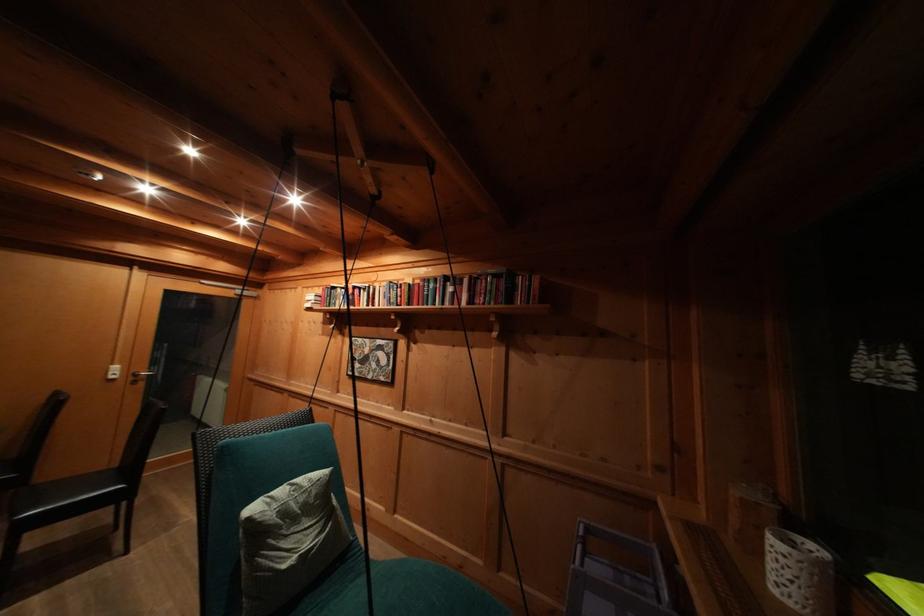
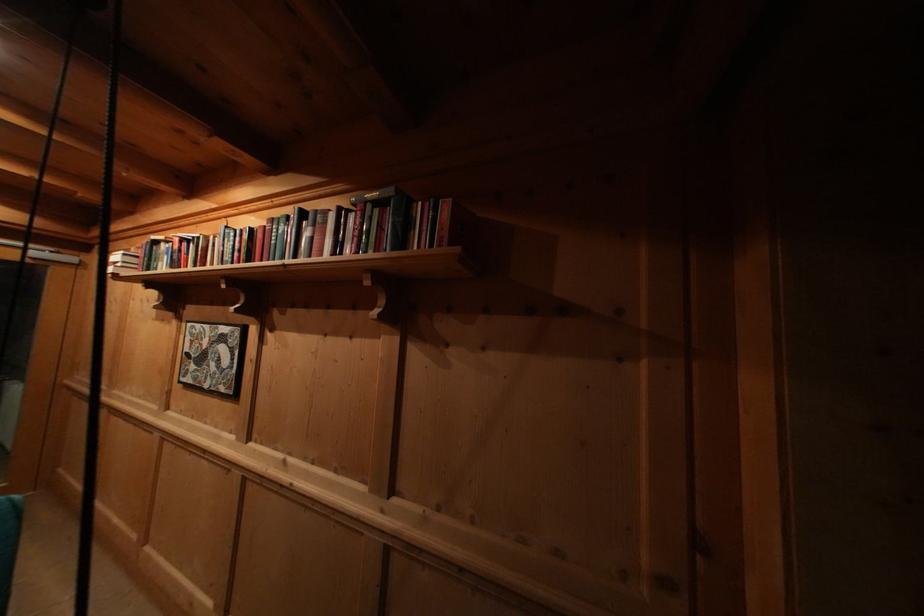
Question: The first image is from the beginning of the video and the second image is from the end. How did the camera likely rotate when shooting the video?

Choices:
 (A) Left
 (B) Right
 (C) Up
 (D) Down

Answer: (B)